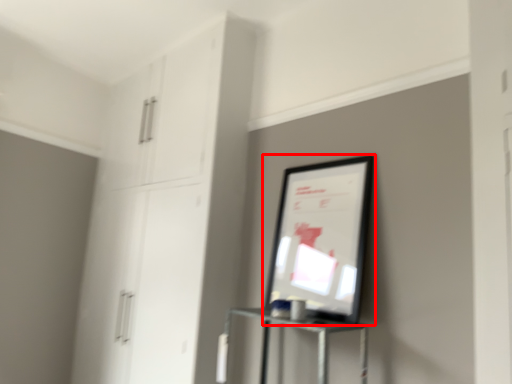
Question: Where is picture frame (annotated by the red box) located in relation to dresser in the image?

Choices:
 (A) right
 (B) left

Answer: (A)